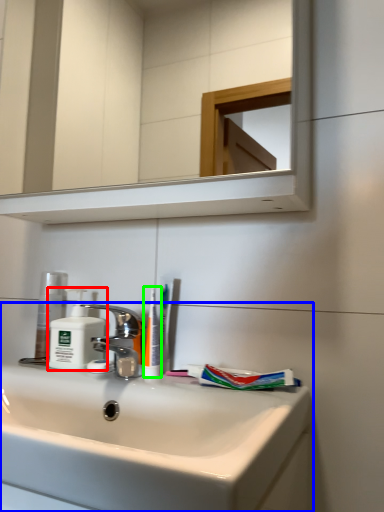
Question: Which is farther away from soap dispenser (highlighted by a red box)? sink (highlighted by a blue box) or toothbrush (highlighted by a green box)?

Choices:
 (A) sink
 (B) toothbrush

Answer: (A)